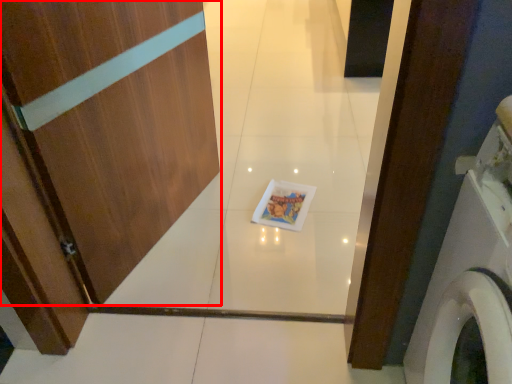
Question: Observing the image, what is the correct spatial positioning of door (annotated by the red box) in reference to washing machine?

Choices:
 (A) left
 (B) right

Answer: (A)